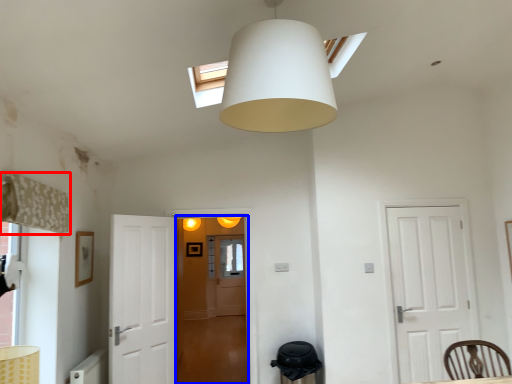
Question: Which object appears farthest to the camera in this image, curtain (highlighted by a red box) or glass door (highlighted by a blue box)?

Choices:
 (A) curtain
 (B) glass door

Answer: (B)